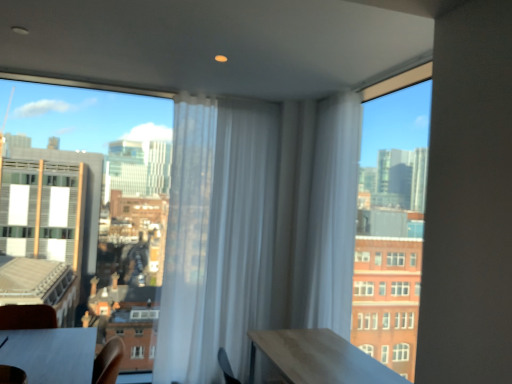
Question: Considering the positions of smooth wooden table at lower left and transparent glass window at upper left, placed as the second window when sorted from right to left, in the image, is smooth wooden table at lower left wider or thinner than transparent glass window at upper left, placed as the second window when sorted from right to left,?

Choices:
 (A) thin
 (B) wide

Answer: (B)

Question: In the image, is smooth wooden table at lower left positioned in front of or behind transparent glass window at upper left, placed as the second window when sorted from right to left?

Choices:
 (A) behind
 (B) front

Answer: (B)

Question: Considering the real-world distances, which object is farthest from the transparent glass window at upper right, placed as the 1th window when sorted from right to left?

Choices:
 (A) white sheer curtain at center, the 1th curtain when ordered from right to left
 (B) transparent glass window at upper left, the 1th window viewed from the left
 (C) white sheer curtain at center, acting as the 2th curtain starting from the right
 (D) smooth wooden table at lower left

Answer: (B)

Question: Which of these objects is positioned farthest from the transparent glass window at upper right, placed as the 1th window when sorted from right to left?

Choices:
 (A) white sheer curtain at center, acting as the second curtain starting from the left
 (B) white sheer curtain at center, the first curtain positioned from the left
 (C) transparent glass window at upper left, placed as the second window when sorted from right to left
 (D) smooth wooden table at lower left

Answer: (C)